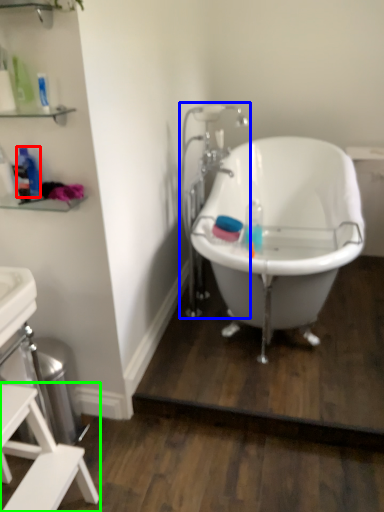
Question: Based on their relative distances, which object is nearer to bottle (highlighted by a red box)? Choose from faucet (highlighted by a blue box) and furniture (highlighted by a green box).

Choices:
 (A) faucet
 (B) furniture

Answer: (B)